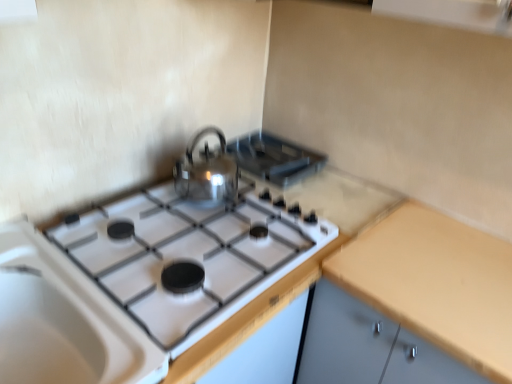
Question: Can you confirm if yellow matte countertop at right is shorter than shiny metallic kettle at center?

Choices:
 (A) yes
 (B) no

Answer: (B)

Question: From a real-world perspective, does yellow matte countertop at right sit lower than shiny metallic kettle at center?

Choices:
 (A) yes
 (B) no

Answer: (A)

Question: Does yellow matte countertop at right contain shiny metallic kettle at center?

Choices:
 (A) yes
 (B) no

Answer: (B)

Question: Does yellow matte countertop at right appear on the left side of shiny metallic kettle at center?

Choices:
 (A) yes
 (B) no

Answer: (B)

Question: Is the position of yellow matte countertop at right more distant than that of shiny metallic kettle at center?

Choices:
 (A) yes
 (B) no

Answer: (B)

Question: Is yellow matte countertop at right positioned in front of shiny metallic kettle at center?

Choices:
 (A) no
 (B) yes

Answer: (B)

Question: Is yellow matte countertop at right bigger than white glossy gas stove at center?

Choices:
 (A) no
 (B) yes

Answer: (B)

Question: Can you confirm if yellow matte countertop at right is smaller than white glossy gas stove at center?

Choices:
 (A) yes
 (B) no

Answer: (B)

Question: Considering the relative sizes of yellow matte countertop at right and white glossy gas stove at center in the image provided, is yellow matte countertop at right taller than white glossy gas stove at center?

Choices:
 (A) no
 (B) yes

Answer: (B)

Question: Considering the relative sizes of yellow matte countertop at right and white glossy gas stove at center in the image provided, is yellow matte countertop at right thinner than white glossy gas stove at center?

Choices:
 (A) no
 (B) yes

Answer: (A)

Question: Could you tell me if yellow matte countertop at right is facing white glossy gas stove at center?

Choices:
 (A) no
 (B) yes

Answer: (A)

Question: Is yellow matte countertop at right completely or partially outside of white glossy gas stove at center?

Choices:
 (A) no
 (B) yes

Answer: (B)

Question: Can you confirm if shiny metallic kettle at center is shorter than yellow matte countertop at right?

Choices:
 (A) no
 (B) yes

Answer: (B)